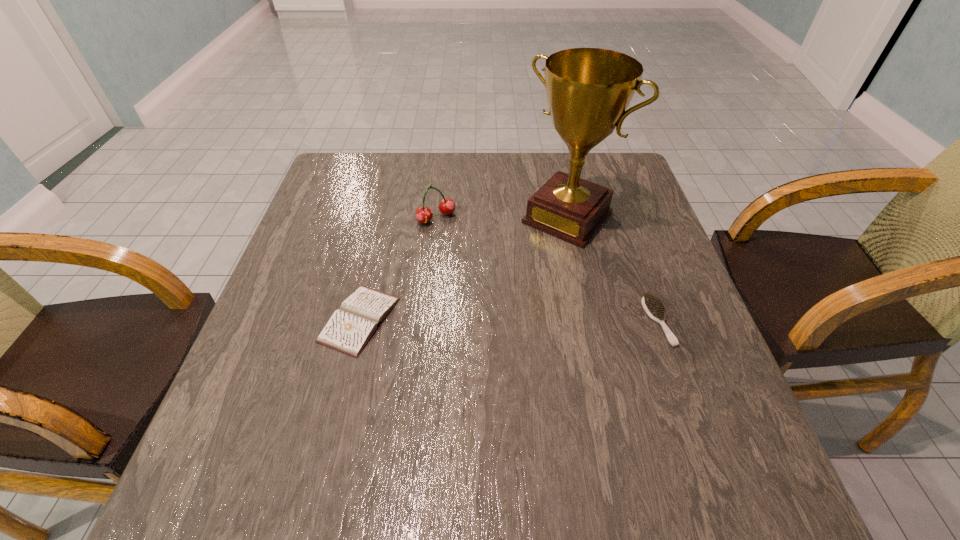
The height and width of the screenshot is (540, 960). Identify the location of free space between the award and the cherry. (502, 218).

This screenshot has height=540, width=960. I want to click on free space between the scrubbing brush and the shortest object, so click(x=509, y=320).

This screenshot has width=960, height=540. In order to click on vacant area that lies between the diary and the third tallest object in this screenshot , I will do click(x=509, y=320).

Identify the location of empty space between the scrubbing brush and the third shortest object. This screenshot has height=540, width=960. (547, 270).

I want to click on free area in between the second tallest object and the diary, so click(x=398, y=269).

Locate which object ranks third in proximity to the leftmost object. Please provide its 2D coordinates. Your answer should be formatted as a tuple, i.e. [(x, y)], where the tuple contains the x and y coordinates of a point satisfying the conditions above.

[(652, 304)]

This screenshot has height=540, width=960. I want to click on object that is the second closest to the award, so click(x=446, y=206).

I want to click on vacant space that satisfies the following two spatial constraints: 1. on the front side of the scrubbing brush; 2. on the left side of the leftmost object, so click(x=359, y=321).

Find the location of a particular element. vacant space that satisfies the following two spatial constraints: 1. on the back side of the third object from right to left; 2. on the left side of the award is located at coordinates (437, 218).

I want to click on free location that satisfies the following two spatial constraints: 1. on the back side of the tallest object; 2. on the left side of the leftmost object, so click(x=384, y=218).